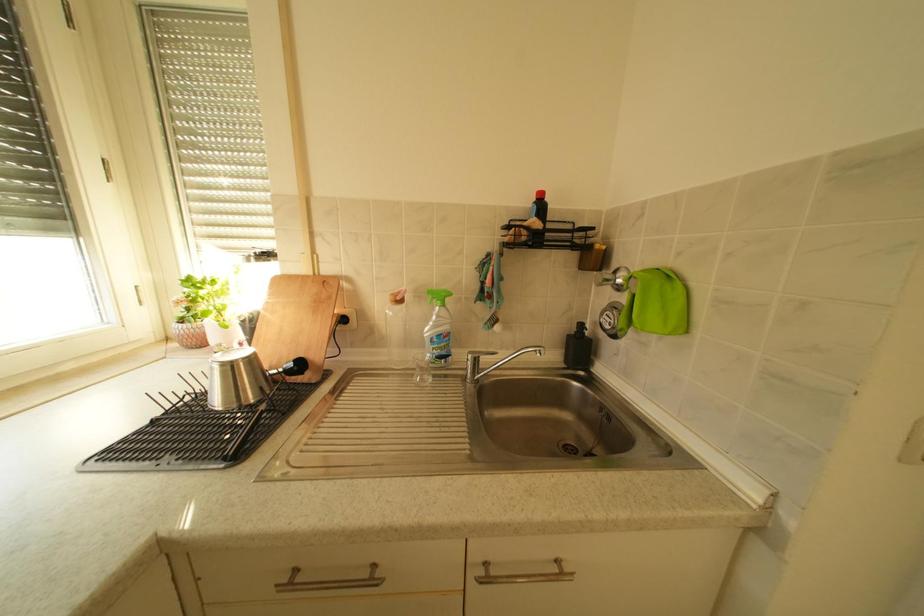
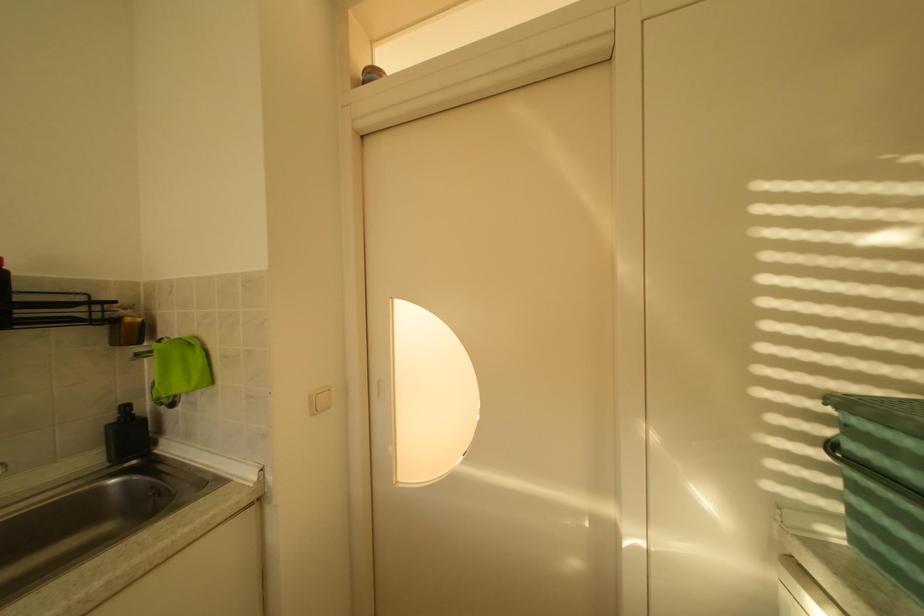
Question: Based on the continuous images, in which direction is the camera rotating? Reply with the corresponding letter.

Choices:
 (A) Left
 (B) Right
 (C) Up
 (D) Down

Answer: (B)